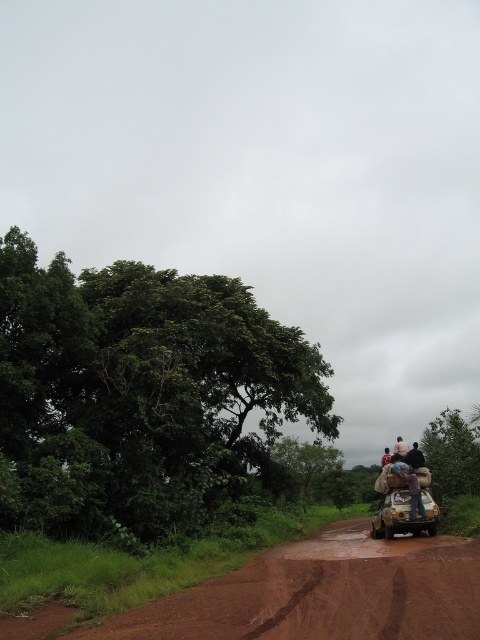
In the scene shown: You are a delivery person trying to navigate through the rural area shown in the image. You see the metallic silver car at lower right and the pink fabric at upper right. Which object is closer to the ground?

The metallic silver car at lower right has a lesser height compared to the pink fabric at upper right, so the metallic silver car at lower right is closer to the ground.